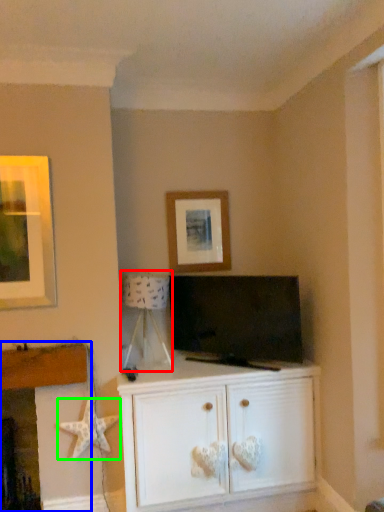
Question: Considering the real-world distances, which object is closest to lamp (highlighted by a red box)? fireplace (highlighted by a blue box) or starfish (highlighted by a green box).

Choices:
 (A) fireplace
 (B) starfish

Answer: (A)